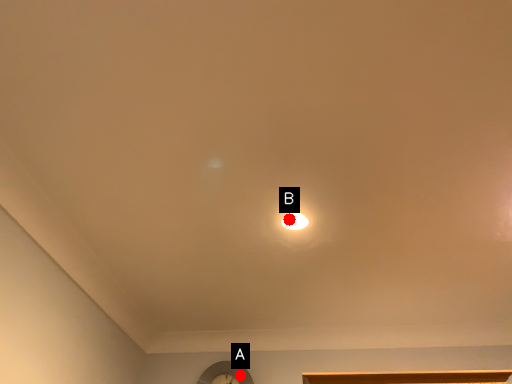
Question: Two points are circled on the image, labeled by A and B beside each circle. Among these points, which one is nearest to the camera?

Choices:
 (A) A is closer
 (B) B is closer

Answer: (B)